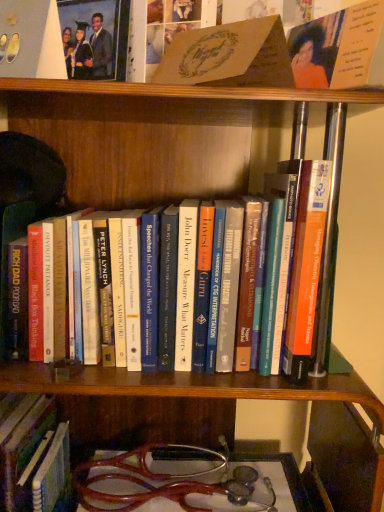
Question: Is hardcover book at center, which is the 1th book from bottom to top, aimed at orange matte card at upper right, acting as the first book starting from the top?

Choices:
 (A) no
 (B) yes

Answer: (A)

Question: From the image's perspective, is hardcover book at center, which is the 4th book from top to bottom, over orange matte card at upper right, acting as the first book starting from the top?

Choices:
 (A) yes
 (B) no

Answer: (B)

Question: Is hardcover book at center, which is the 4th book from top to bottom, at the right side of orange matte card at upper right, acting as the first book starting from the top?

Choices:
 (A) no
 (B) yes

Answer: (A)

Question: Can you confirm if hardcover book at center, which is the 1th book from bottom to top, is positioned to the left of orange matte card at upper right, acting as the first book starting from the top?

Choices:
 (A) no
 (B) yes

Answer: (B)

Question: Does hardcover book at center, which is the 4th book from top to bottom, lie behind orange matte card at upper right, acting as the first book starting from the top?

Choices:
 (A) yes
 (B) no

Answer: (A)

Question: Are hardcover book at center, which is the 4th book from top to bottom, and orange matte card at upper right, the 4th book ordered from the bottom, making contact?

Choices:
 (A) yes
 (B) no

Answer: (B)

Question: Is matte black graduation gown at upper left outside of matte brown card at upper center, the 3th book from the bottom?

Choices:
 (A) no
 (B) yes

Answer: (B)

Question: Can you confirm if matte black graduation gown at upper left is bigger than matte brown card at upper center, which ranks as the second book in top-to-bottom order?

Choices:
 (A) no
 (B) yes

Answer: (A)

Question: Is matte black graduation gown at upper left facing away from matte brown card at upper center, the 3th book from the bottom?

Choices:
 (A) yes
 (B) no

Answer: (B)

Question: Is there a large distance between matte black graduation gown at upper left and matte brown card at upper center, the 3th book from the bottom?

Choices:
 (A) yes
 (B) no

Answer: (B)

Question: Does matte black graduation gown at upper left have a lesser height compared to matte brown card at upper center, which ranks as the second book in top-to-bottom order?

Choices:
 (A) no
 (B) yes

Answer: (A)

Question: Is matte black graduation gown at upper left at the right side of matte brown card at upper center, which ranks as the second book in top-to-bottom order?

Choices:
 (A) no
 (B) yes

Answer: (A)

Question: Are matte black graduation gown at upper left and hardcover book at center, placed as the 3th book when sorted from top to bottom, beside each other?

Choices:
 (A) yes
 (B) no

Answer: (B)